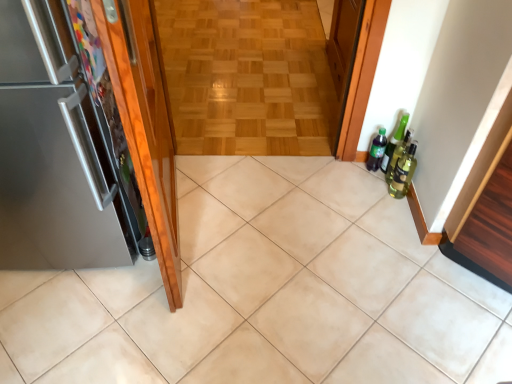
I want to click on vacant area situated below wooden cabinet at right (from a real-world perspective), so click(x=480, y=297).